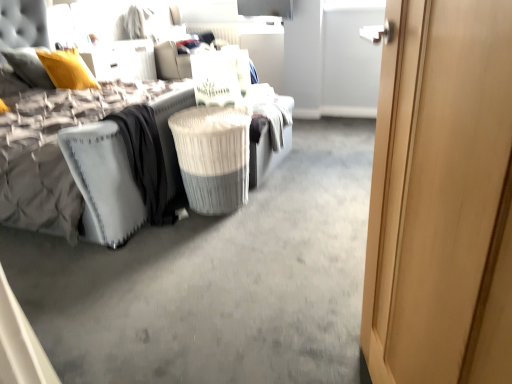
The image size is (512, 384). Find the location of `vacant space in front of white wicker laundry basket at center`. vacant space in front of white wicker laundry basket at center is located at coordinates (199, 240).